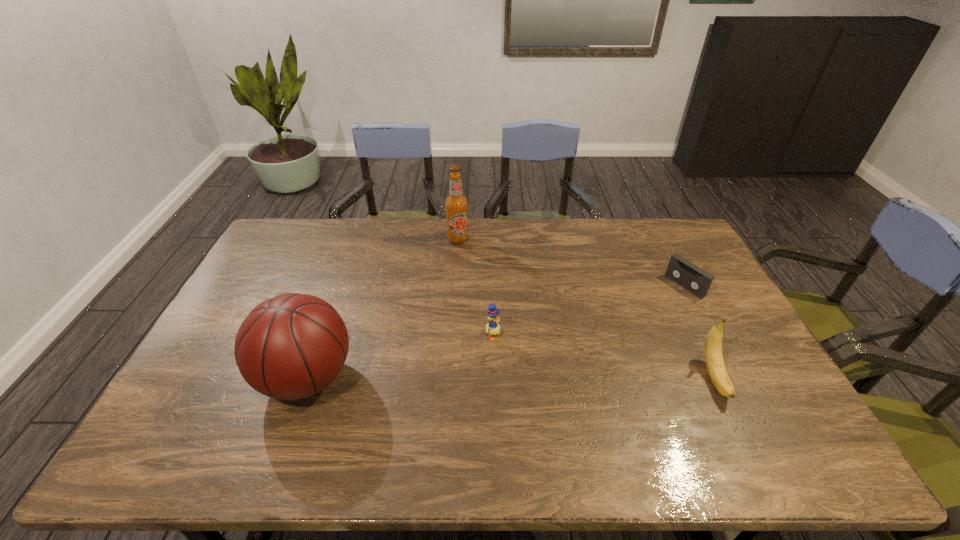
This screenshot has width=960, height=540. What are the coordinates of `vacant space on the desktop that is between the leftmost object and the third tallest object and is positioned on the front-facing side of the second farthest object` in the screenshot? It's located at (532, 377).

Where is `vacant spot on the desktop that is between the leftmost object and the banana and is positioned on the face of the duckling, where the monocle is placed`? vacant spot on the desktop that is between the leftmost object and the banana and is positioned on the face of the duckling, where the monocle is placed is located at coordinates (565, 378).

Identify the location of vacant space on the desktop that is between the leftmost object and the third shortest object and is positioned on the front label of the second object from left to right. (492, 377).